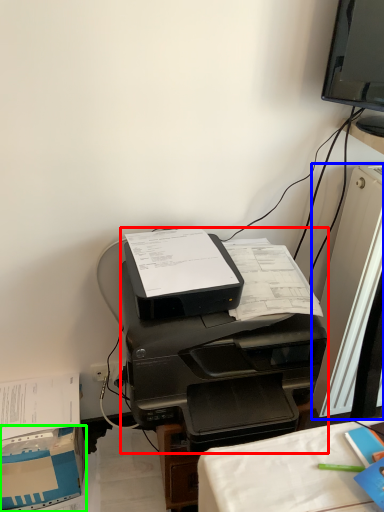
Question: Which object is the farthest from printer (highlighted by a red box)? Choose among these: desktop computer (highlighted by a blue box) or cardboard box (highlighted by a green box).

Choices:
 (A) desktop computer
 (B) cardboard box

Answer: (B)